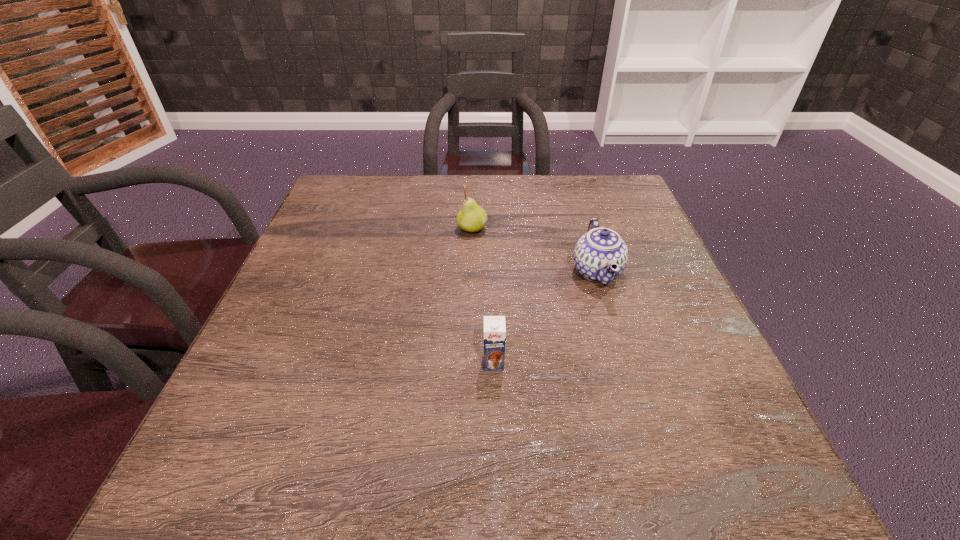
Locate an element on the screen. the farthest object is located at coordinates (472, 218).

Locate an element on the screen. chinaware is located at coordinates [x=600, y=255].

Image resolution: width=960 pixels, height=540 pixels. Find the location of `the second nearest object`. the second nearest object is located at coordinates (600, 255).

Find the location of `the nearest object`. the nearest object is located at coordinates (494, 326).

The height and width of the screenshot is (540, 960). Identify the location of vacant space located on the right of the farthest object. (546, 228).

The width and height of the screenshot is (960, 540). I want to click on vacant position located 0.130m at the spout of the rightmost object, so click(514, 272).

Locate an element on the screen. vacant region located 0.240m at the spout of the rightmost object is located at coordinates (465, 272).

Where is `vacant space located 0.360m at the spout of the rightmost object`? This screenshot has width=960, height=540. vacant space located 0.360m at the spout of the rightmost object is located at coordinates (411, 272).

Locate an element on the screen. free spot located on the front label of the nearest object is located at coordinates (496, 451).

Where is `object located at the right edge`? The height and width of the screenshot is (540, 960). object located at the right edge is located at coordinates (600, 255).